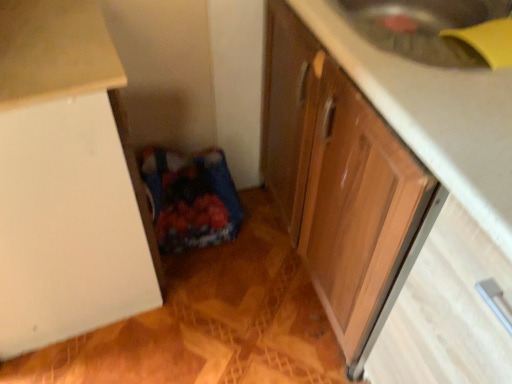
Locate an element on the screen. free space above white matte cabinet at left, which is the 1th cabinetry from left to right (from a real-world perspective) is located at coordinates (40, 33).